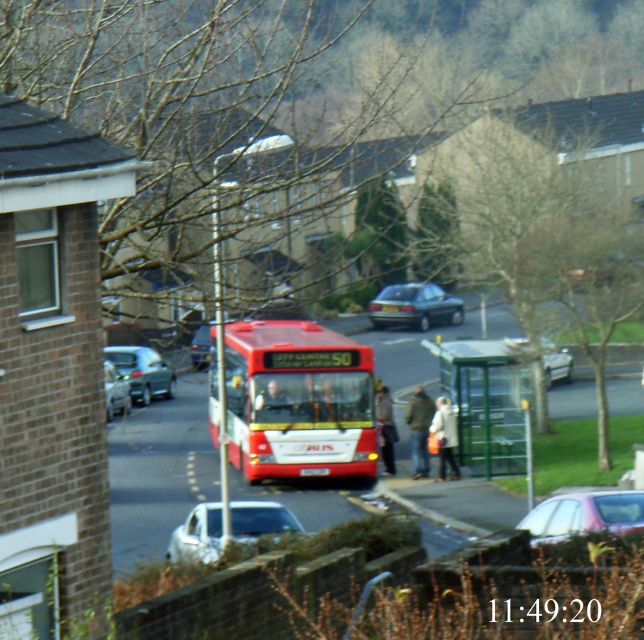
From the picture: Who is more forward, (422, 465) or (386, 440)?

Point (422, 465) is more forward.

Which of these two, dark brown leather jacket at center or dark gray fabric jacket at center, stands taller?

dark gray fabric jacket at center is taller.

Between point (412, 406) and point (392, 417), which one is positioned in front?

Point (392, 417)

Identify the location of dark brown leather jacket at center. Image resolution: width=644 pixels, height=640 pixels. (419, 429).

Does green metallic bus stop at center lie in front of white fabric coat at center?

Yes, green metallic bus stop at center is closer to the viewer.

Who is more distant from viewer, (442, 371) or (451, 468)?

Positioned behind is point (442, 371).

Locate an element on the screen. green metallic bus stop at center is located at coordinates (486, 401).

Where is `green metallic bus stop at center`? Image resolution: width=644 pixels, height=640 pixels. green metallic bus stop at center is located at coordinates (486, 401).

From the picture: How distant is white fabric coat at center from silver metallic sedan at center?

white fabric coat at center is 3.93 meters from silver metallic sedan at center.

What do you see at coordinates (446, 436) in the screenshot? The image size is (644, 640). I see `white fabric coat at center` at bounding box center [446, 436].

Find the location of a particular element. white fabric coat at center is located at coordinates (446, 436).

Locate an element on the screen. This screenshot has width=644, height=640. white fabric coat at center is located at coordinates (446, 436).